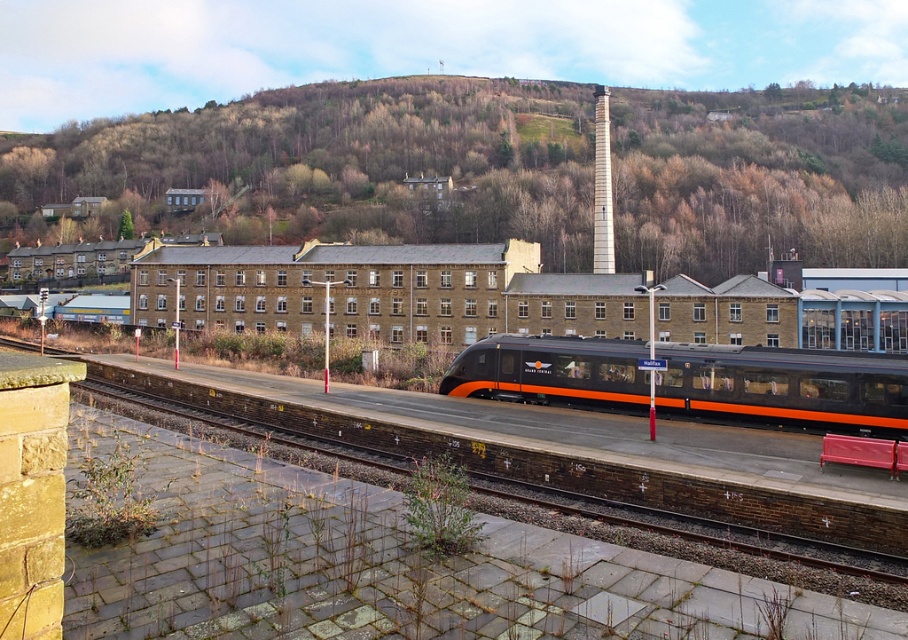
Question: Is brown textured hillside at upper center to the left of matte black train at center from the viewer's perspective?

Choices:
 (A) yes
 (B) no

Answer: (A)

Question: Which point is closer to the camera?

Choices:
 (A) brown textured hillside at upper center
 (B) matte black train at center

Answer: (B)

Question: Which point is closer to the camera?

Choices:
 (A) brown textured hillside at upper center
 (B) matte black train at center

Answer: (B)

Question: Does brown textured hillside at upper center appear on the right side of matte black train at center?

Choices:
 (A) no
 (B) yes

Answer: (A)

Question: Does brown textured hillside at upper center appear on the right side of matte black train at center?

Choices:
 (A) yes
 (B) no

Answer: (B)

Question: Which point is closer to the camera?

Choices:
 (A) (579, 388)
 (B) (614, 241)

Answer: (A)